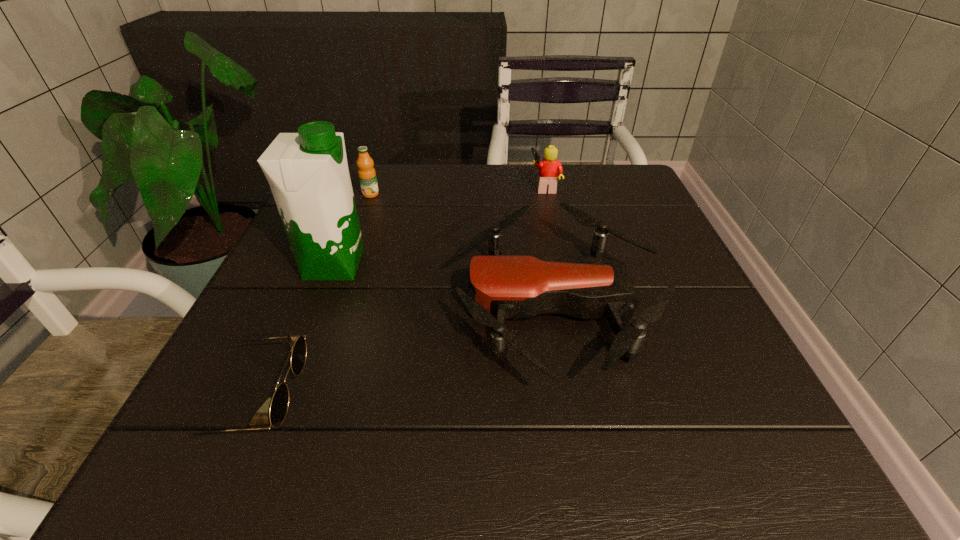
The image size is (960, 540). I want to click on soya milk, so click(x=308, y=174).

The height and width of the screenshot is (540, 960). What are the coordinates of `orange juice` in the screenshot? It's located at (367, 176).

Identify the location of Lego. The image size is (960, 540). (549, 168).

Identify the location of drone. Image resolution: width=960 pixels, height=540 pixels. (502, 287).

What are the coordinates of `the shortest object` in the screenshot? It's located at (279, 405).

This screenshot has height=540, width=960. I want to click on free region located on the front-facing side of the tallest object, so click(x=512, y=265).

You are a GUI agent. You are given a task and a screenshot of the screen. Output one action in this format:
    pyautogui.click(x=<x>, y=<y>)
    Task: Click on the free location located 0.210m on the label of the orange juice
    
    Given the screenshot: What is the action you would take?
    pyautogui.click(x=349, y=252)

You are a GUI agent. You are given a task and a screenshot of the screen. Output one action in this format:
    pyautogui.click(x=<x>, y=<y>)
    Task: Click on the vacant space situated 0.320m in front of the Lego with the accessory visible
    This screenshot has height=540, width=960.
    Given the screenshot: What is the action you would take?
    pyautogui.click(x=402, y=187)

Locate an element on the screen. Image resolution: width=960 pixels, height=540 pixels. vacant space located 0.310m in front of the Lego with the accessory visible is located at coordinates (407, 187).

Find the location of a particular element. The height and width of the screenshot is (540, 960). vacant space located 0.260m in front of the Lego with the accessory visible is located at coordinates (426, 187).